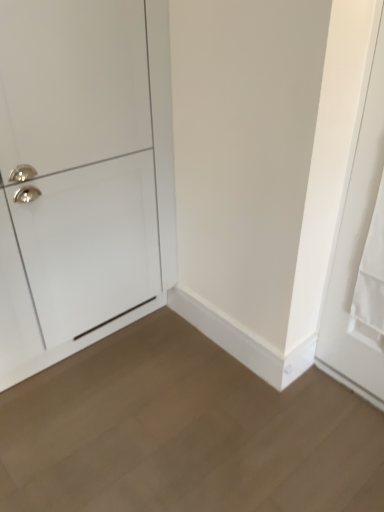
Question: Is light brown wood floor at lower center facing towards white matte door at right, the first door when ordered from right to left?

Choices:
 (A) yes
 (B) no

Answer: (B)

Question: Does light brown wood floor at lower center lie in front of white matte door at right, the first door when ordered from right to left?

Choices:
 (A) no
 (B) yes

Answer: (B)

Question: Would you say light brown wood floor at lower center is outside white matte door at right, the second door positioned from the left?

Choices:
 (A) no
 (B) yes

Answer: (B)

Question: Is white matte door at right, the second door positioned from the left, surrounded by light brown wood floor at lower center?

Choices:
 (A) yes
 (B) no

Answer: (B)

Question: Is light brown wood floor at lower center smaller than white matte door at right, the first door when ordered from right to left?

Choices:
 (A) no
 (B) yes

Answer: (A)

Question: Considering the relative positions of light brown wood floor at lower center and white matte door at right, the first door when ordered from right to left, in the image provided, is light brown wood floor at lower center to the left of white matte door at right, the first door when ordered from right to left, from the viewer's perspective?

Choices:
 (A) no
 (B) yes

Answer: (B)

Question: Considering the relative sizes of white glossy cabinet at left, the first door from the left, and white matte door at right, the second door positioned from the left, in the image provided, is white glossy cabinet at left, the first door from the left, thinner than white matte door at right, the second door positioned from the left,?

Choices:
 (A) no
 (B) yes

Answer: (A)

Question: Is white glossy cabinet at left, the second door in the right-to-left sequence, further to the viewer compared to white matte door at right, the second door positioned from the left?

Choices:
 (A) yes
 (B) no

Answer: (A)

Question: Considering the relative sizes of white glossy cabinet at left, the second door in the right-to-left sequence, and white matte door at right, the first door when ordered from right to left, in the image provided, is white glossy cabinet at left, the second door in the right-to-left sequence, wider than white matte door at right, the first door when ordered from right to left,?

Choices:
 (A) yes
 (B) no

Answer: (A)

Question: Would you consider white glossy cabinet at left, the first door from the left, to be distant from white matte door at right, the second door positioned from the left?

Choices:
 (A) yes
 (B) no

Answer: (B)

Question: Is white matte door at right, the first door when ordered from right to left, at the back of white glossy cabinet at left, the second door in the right-to-left sequence?

Choices:
 (A) yes
 (B) no

Answer: (B)

Question: Is white glossy cabinet at left, the first door from the left, not inside white matte door at right, the second door positioned from the left?

Choices:
 (A) yes
 (B) no

Answer: (A)

Question: Is light brown wood floor at lower center positioned beyond the bounds of white glossy cabinet at left, the first door from the left?

Choices:
 (A) yes
 (B) no

Answer: (A)